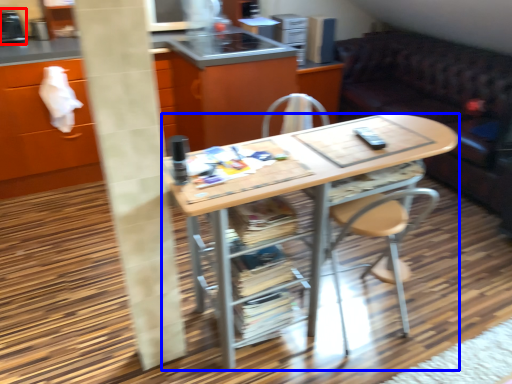
Question: Which point is further to the camera, appliance (highlighted by a red box) or desk (highlighted by a blue box)?

Choices:
 (A) appliance
 (B) desk

Answer: (A)